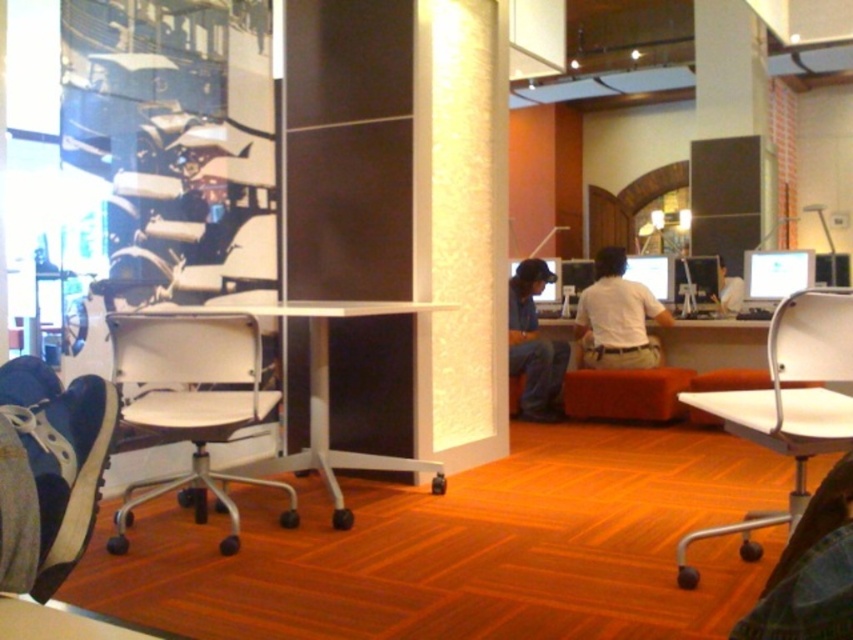
Question: Estimate the real-world distances between objects in this image. Which object is farther from the white plastic chair at center?

Choices:
 (A) white plastic swivel chair at left
 (B) white plastic table at center
 (C) white glossy monitor at center
 (D) white cotton shirt at center

Answer: (C)

Question: From the image, what is the correct spatial relationship of white plastic table at center in relation to denim jeans at center?

Choices:
 (A) below
 (B) above

Answer: (A)

Question: Which object is the closest to the white plastic chair at center?

Choices:
 (A) white plastic table at center
 (B) white plastic swivel chair at left

Answer: (A)

Question: Which object is farther from the camera taking this photo?

Choices:
 (A) white plastic table at center
 (B) white glossy monitor at center
 (C) white plastic swivel chair at left

Answer: (B)

Question: Can you confirm if white plastic swivel chair at left is thinner than white cotton shirt at center?

Choices:
 (A) no
 (B) yes

Answer: (A)

Question: Is white plastic swivel chair at left wider than denim jeans at center?

Choices:
 (A) yes
 (B) no

Answer: (A)